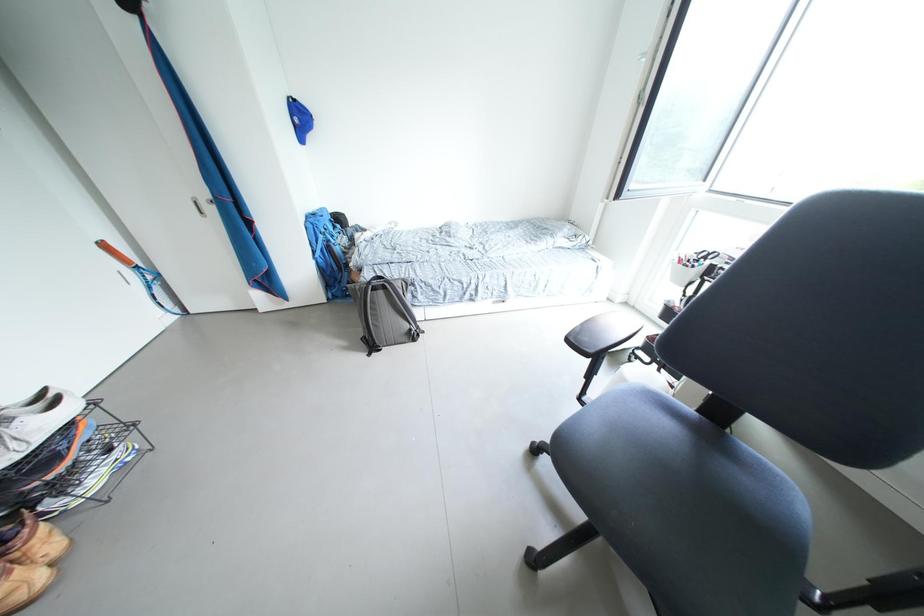
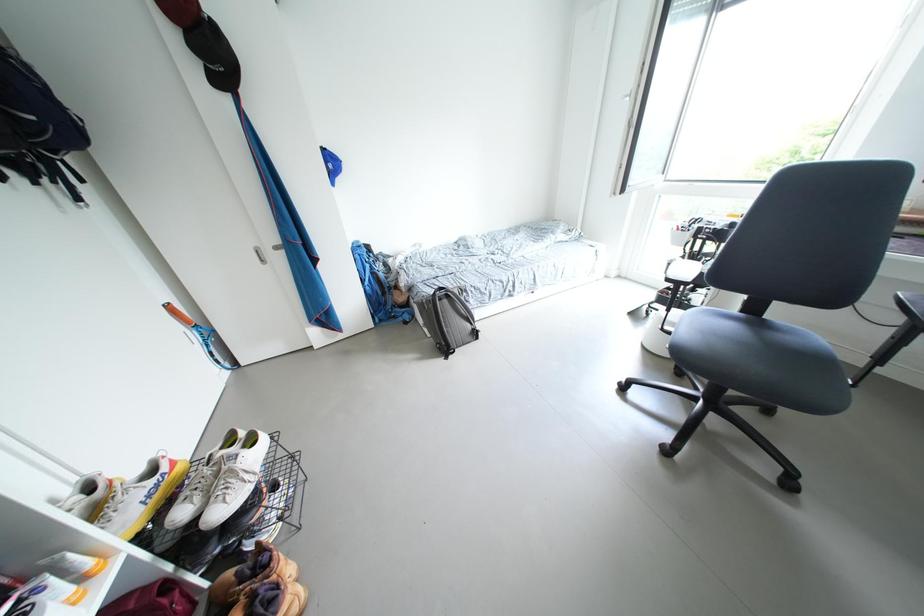
Question: What movement of the cameraman would produce the second image?

Choices:
 (A) Left
 (B) Right
 (C) Forward
 (D) Backward

Answer: (A)